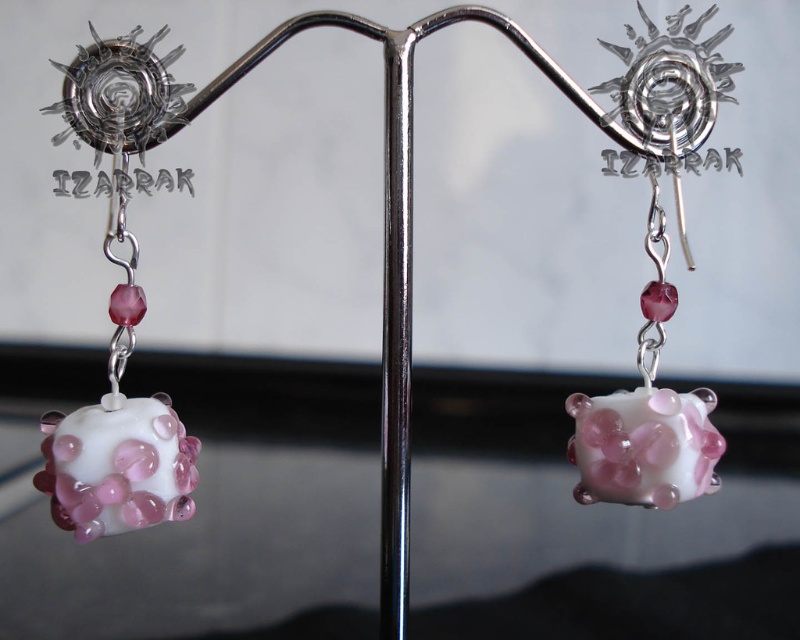
Consider the image. You are an appraiser evaluating the symmetry of the earrings. The ideal placement for the central bead is at the exact center of the earring, which is at point coordinates of 0.5, 0.5. Is the white glossy bead at center positioned closer to the top or bottom of the earring?

The white glossy bead at center is positioned at point coordinates of (118, 310). Since the y coordinate 0.149 is lower than 0.5, the bead is closer to the bottom of the earring.

Based on the photo, you are an appraiser examining the earrings displayed on the metal stand. You notice two specific points marked on the earrings, point 1 at coordinates point 1 at point (80, 58) and point 2 at point (388, 490). From your perspective, which point is closer to you?

Point 1 at point (80, 58) is closer to you because it is in front of point 2 at point (388, 490).

You are an appraiser examining the earrings displayed on a metal stand. You need to determine the position of the translucent pink glass cube at center relative to the metallic sun structure. Based on the coordinates provided, is the cube positioned above or below the sun structure?

The translucent pink glass cube at center is located at point (654, 317). Since the y coordinate 0.818 is higher than the sun structure, the cube is positioned above the sun structure.